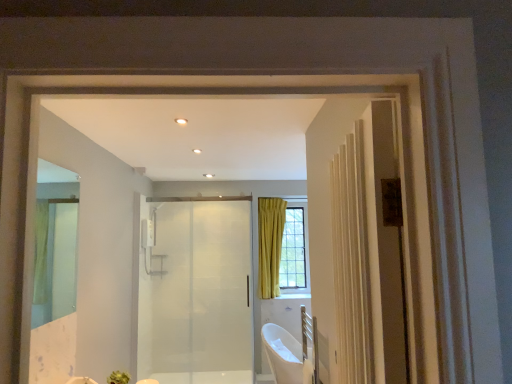
Question: Does clear glass mirror at left have a greater height compared to transparent glass door at center?

Choices:
 (A) no
 (B) yes

Answer: (A)

Question: Can you confirm if clear glass mirror at left is positioned to the right of transparent glass door at center?

Choices:
 (A) no
 (B) yes

Answer: (A)

Question: Is clear glass mirror at left further to the viewer compared to transparent glass door at center?

Choices:
 (A) yes
 (B) no

Answer: (B)

Question: From a real-world perspective, does clear glass mirror at left stand above transparent glass door at center?

Choices:
 (A) yes
 (B) no

Answer: (A)

Question: Can you confirm if clear glass mirror at left is smaller than transparent glass door at center?

Choices:
 (A) yes
 (B) no

Answer: (A)

Question: Is transparent glass door at center surrounded by clear glass mirror at left?

Choices:
 (A) yes
 (B) no

Answer: (B)

Question: From the image's perspective, is transparent glass door at center above clear glass mirror at left?

Choices:
 (A) no
 (B) yes

Answer: (A)

Question: Considering the relative sizes of transparent glass door at center and clear glass mirror at left in the image provided, is transparent glass door at center smaller than clear glass mirror at left?

Choices:
 (A) yes
 (B) no

Answer: (B)

Question: Is transparent glass door at center further to the viewer compared to clear glass mirror at left?

Choices:
 (A) no
 (B) yes

Answer: (B)

Question: Does transparent glass door at center appear on the left side of clear glass mirror at left?

Choices:
 (A) no
 (B) yes

Answer: (A)

Question: Would you say clear glass mirror at left is part of transparent glass door at center's contents?

Choices:
 (A) yes
 (B) no

Answer: (B)

Question: Is transparent glass door at center in front of clear glass mirror at left?

Choices:
 (A) yes
 (B) no

Answer: (B)

Question: From a real-world perspective, is clear glass mirror at left beneath white glossy bathtub at lower center?

Choices:
 (A) yes
 (B) no

Answer: (B)